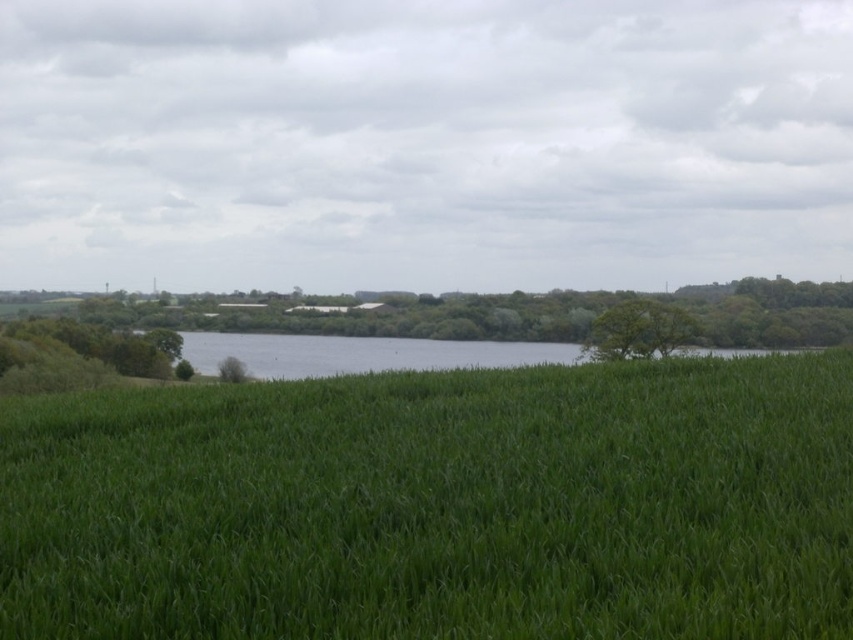
Question: Can you confirm if green leafy tree at lower left is smaller than green leafy tree at right?

Choices:
 (A) yes
 (B) no

Answer: (B)

Question: Where is clear water at center located in relation to green leafy tree at right in the image?

Choices:
 (A) right
 (B) left

Answer: (B)

Question: Is green grassy field at center below green leafy tree at lower left?

Choices:
 (A) yes
 (B) no

Answer: (B)

Question: Based on their relative distances, which object is farther from the clear water at center?

Choices:
 (A) green leafy tree at right
 (B) green leafy tree at lower left

Answer: (B)

Question: Estimate the real-world distances between objects in this image. Which object is farther from the green leafy tree at right?

Choices:
 (A) clear water at center
 (B) green grassy field at center
 (C) green leafy tree at lower left

Answer: (B)

Question: Estimate the real-world distances between objects in this image. Which object is farther from the green leafy tree at lower left?

Choices:
 (A) clear water at center
 (B) green leafy tree at right
 (C) green grassy field at center

Answer: (C)